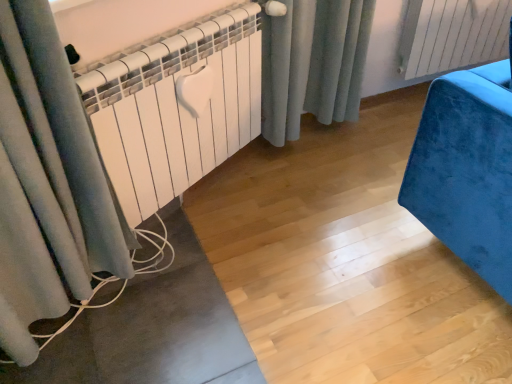
Measure the distance between white matte radiator at left and camera.

They are 1.15 meters apart.

Identify the location of white matte radiator at left. Image resolution: width=512 pixels, height=384 pixels. (175, 110).

The width and height of the screenshot is (512, 384). What do you see at coordinates (175, 110) in the screenshot? I see `white matte radiator at left` at bounding box center [175, 110].

This screenshot has width=512, height=384. Identify the location of white matte radiator at left. (175, 110).